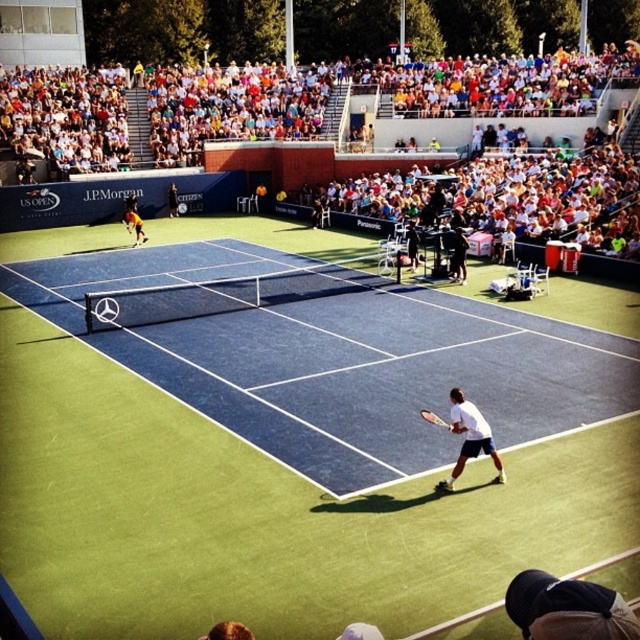
Question: Does blue carpet tennis court at center have a smaller size compared to multicolored fabric crowd at upper center?

Choices:
 (A) yes
 (B) no

Answer: (A)

Question: Observing the image, what is the correct spatial positioning of yellow-orange tennis racket at upper left in reference to white matte tennis racket at lower center?

Choices:
 (A) left
 (B) right

Answer: (A)

Question: Which of the following is the closest to the observer?

Choices:
 (A) (426, 413)
 (B) (38, 80)
 (C) (147, 372)

Answer: (A)

Question: Is blue carpet tennis court at center to the right of multicolored fabric crowd at upper center from the viewer's perspective?

Choices:
 (A) yes
 (B) no

Answer: (B)

Question: Which point appears farthest from the camera in this image?

Choices:
 (A) (442, 419)
 (B) (595, 65)

Answer: (B)

Question: Which is nearer to the yellow-orange tennis racket at upper left?

Choices:
 (A) white matte tennis racket at lower center
 (B) multicolored fabric crowd at upper center
 (C) blue carpet tennis court at center
 (D) white matte tennis racket at right

Answer: (C)